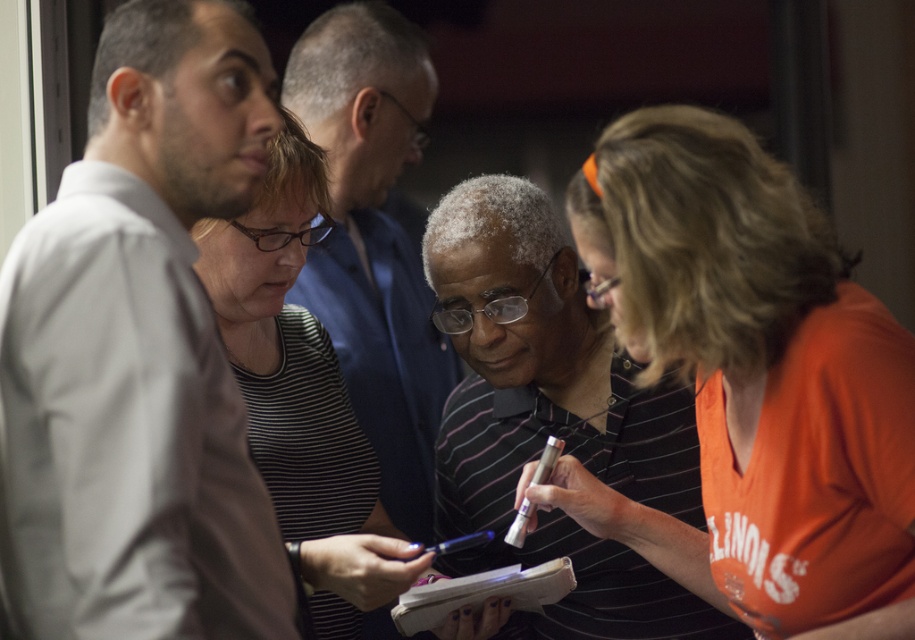
Question: Can you confirm if orange jersey at center is smaller than striped fabric shirt at center?

Choices:
 (A) no
 (B) yes

Answer: (B)

Question: Among these points, which one is nearest to the camera?

Choices:
 (A) click(x=357, y=442)
 (B) click(x=578, y=412)

Answer: (B)

Question: Considering the real-world distances, which object is farthest from the orange jersey at center?

Choices:
 (A) gray shirt at left
 (B) striped fabric shirt at center

Answer: (A)

Question: Does orange jersey at center appear on the right side of blue shirt at center?

Choices:
 (A) no
 (B) yes

Answer: (B)

Question: Can you confirm if gray shirt at left is wider than striped fabric shirt at center?

Choices:
 (A) yes
 (B) no

Answer: (B)

Question: Considering the real-world distances, which object is closest to the striped polo shirt at center?

Choices:
 (A) striped fabric shirt at center
 (B) gray shirt at left
 (C) blue shirt at center

Answer: (A)